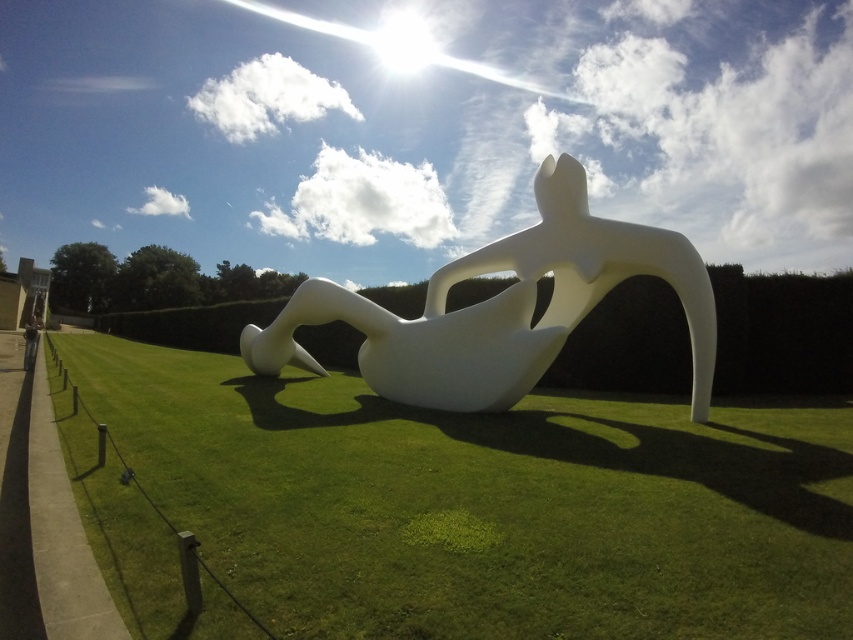
You are a gardener who needs to mow the lawn. The green grass at center and the white glossy sculpture at center are in your path. Which object is shorter and requires mowing?

The green grass at center has a lesser height compared to the white glossy sculpture at center, so the green grass at center is shorter and requires mowing.

You are a gardener who needs to mow the lawn. You see the green grass at center and the white glossy sculpture at center. Which object is located lower in the image?

The green grass at center is located below the white glossy sculpture at center, so it is lower in the image.